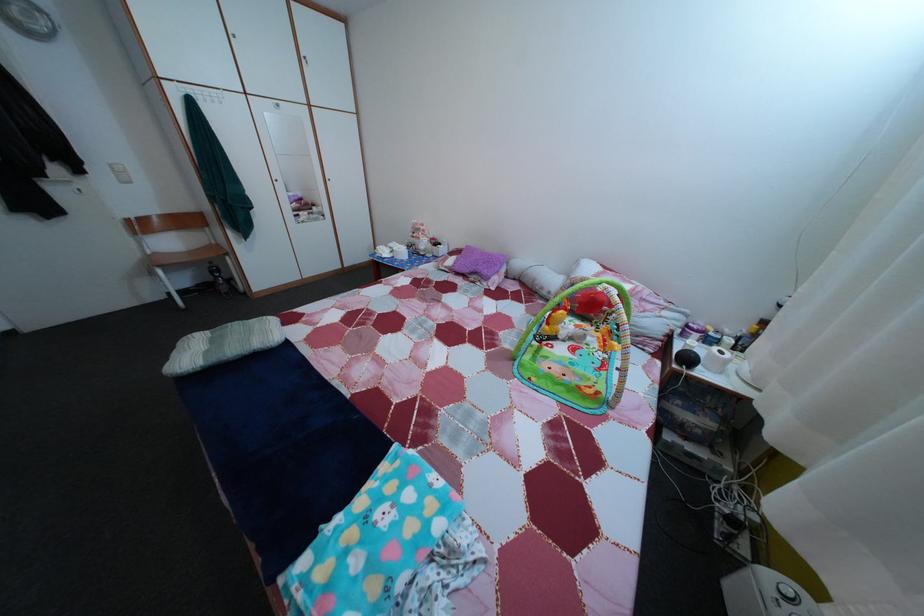
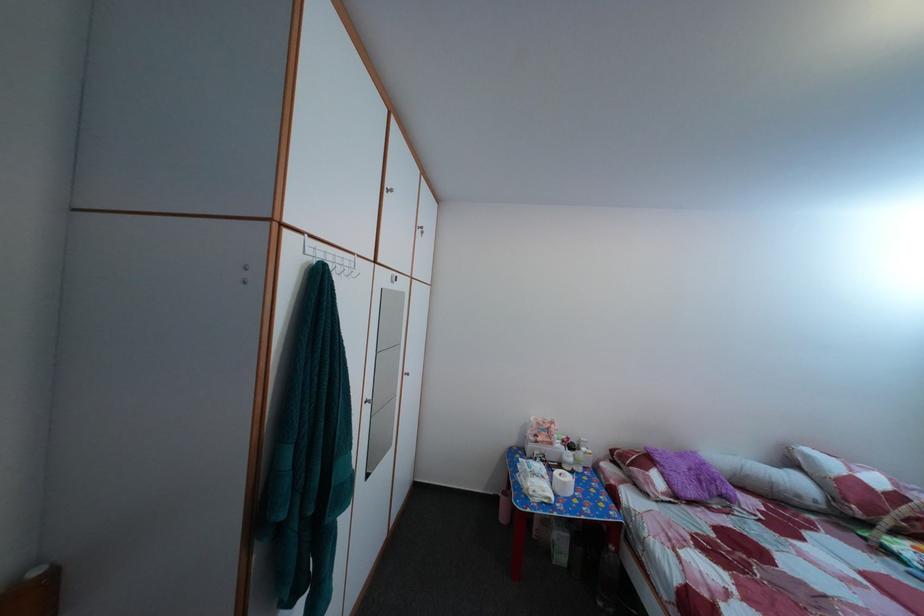
Where in the second image is the point corresponding to point (589, 273) from the first image?

(817, 464)